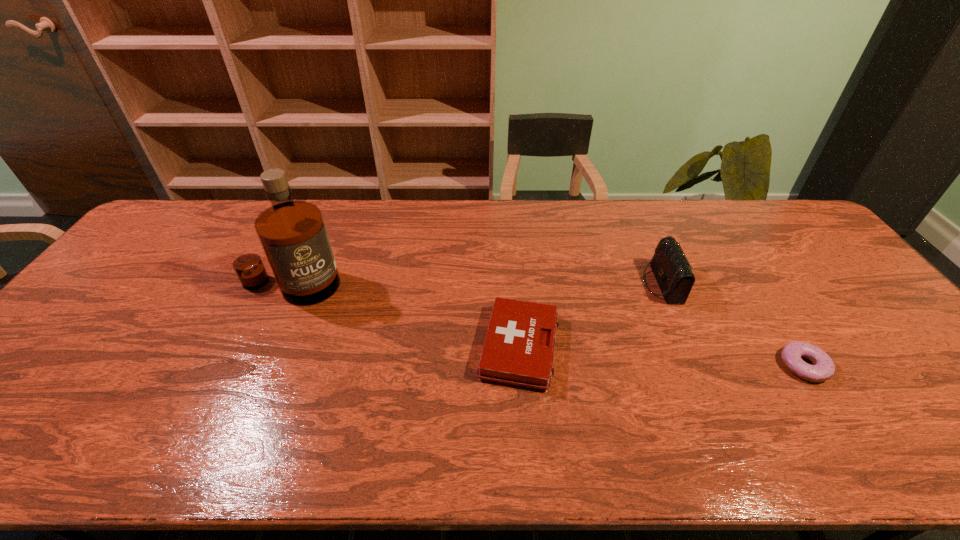
Where is `vacant area that lies between the first-aid kit and the liquor`? vacant area that lies between the first-aid kit and the liquor is located at coordinates (405, 316).

Locate an element on the screen. The height and width of the screenshot is (540, 960). free space that is in between the third shortest object and the leftmost object is located at coordinates (476, 285).

This screenshot has height=540, width=960. I want to click on free space between the liquor and the clutch bag, so click(x=476, y=285).

Image resolution: width=960 pixels, height=540 pixels. In order to click on unoccupied position between the leftmost object and the clutch bag in this screenshot , I will do `click(476, 285)`.

Where is `vacant space that is in between the second object from right to left and the first-aid kit`? This screenshot has height=540, width=960. vacant space that is in between the second object from right to left and the first-aid kit is located at coordinates (590, 315).

Image resolution: width=960 pixels, height=540 pixels. I want to click on unoccupied area between the leftmost object and the third shortest object, so click(476, 285).

The image size is (960, 540). What are the coordinates of `free point between the clutch bag and the shortest object` in the screenshot? It's located at (733, 325).

At what (x,y) coordinates should I click in order to perform the action: click on the closest object to the rightmost object. Please return your answer as a coordinate pair (x, y). Image resolution: width=960 pixels, height=540 pixels. Looking at the image, I should click on (672, 271).

Locate an element on the screen. The width and height of the screenshot is (960, 540). object that stands as the second closest to the third tallest object is located at coordinates (292, 233).

You are a GUI agent. You are given a task and a screenshot of the screen. Output one action in this format:
    pyautogui.click(x=<x>, y=<y>)
    Task: Click on the free spot that satisfies the following two spatial constraints: 1. on the front label of the liquor; 2. on the right side of the first-aid kit
    
    Given the screenshot: What is the action you would take?
    pyautogui.click(x=263, y=347)